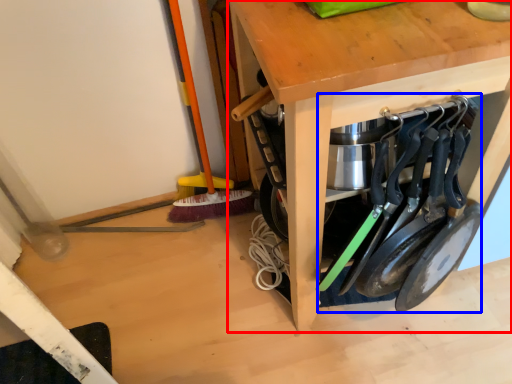
Question: Among these objects, which one is nearest to the camera, table (highlighted by a red box) or tool (highlighted by a blue box)?

Choices:
 (A) table
 (B) tool

Answer: (A)